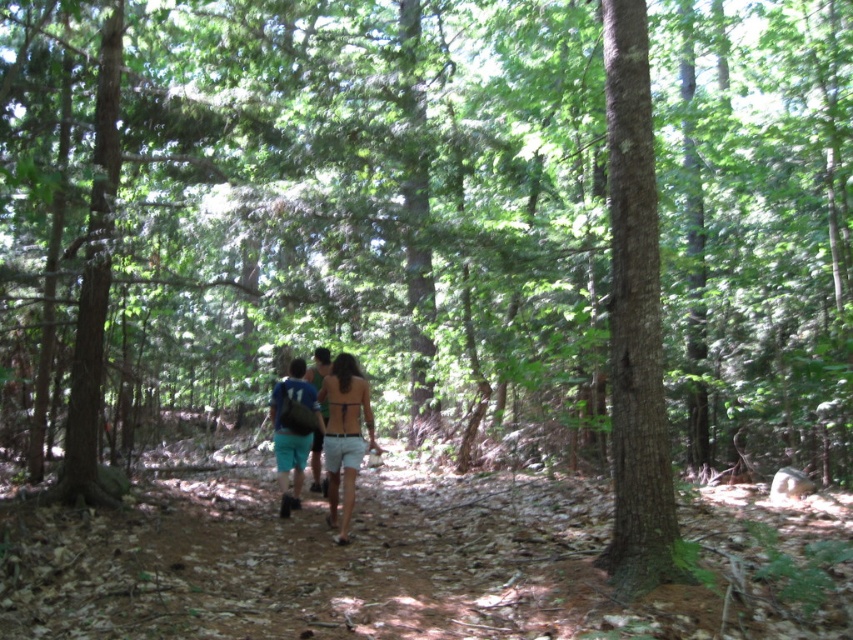
You are a hiker who just arrived at the forest path. You see the blue fabric backpack at center. Where is it located in terms of coordinates?

The blue fabric backpack at center is located at point [293,429].

Based on the photo, you are standing at the point with coordinates (634, 317) in the forest scene. What is the nearest object to you?

The point (634, 317) is on the brown rough bark tree at center right, so the nearest object to you is the brown rough bark tree at center right.

You are a hiker who needs to reach a tree to rest. You are standing at the green fabric shorts at center. The brown rough bark tree at center right is your destination. Can you walk directly to it in a straight line without any obstacles?

The distance between the brown rough bark tree at center right and the green fabric shorts at center is 4.62 meters. Since there are no mentioned obstacles in the scene description, you can walk directly to it in a straight line.